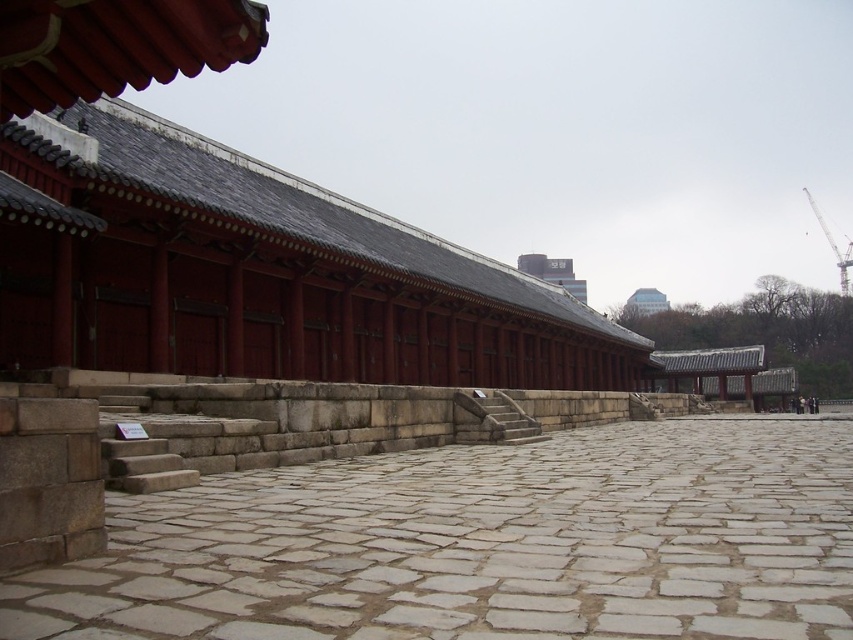
Question: Considering the real-world distances, which object is closest to the matte gray stone palace at upper center?

Choices:
 (A) gray stone courtyard at center
 (B) white glass building at upper center
 (C) matte red wood palace at center
 (D) stone textured stairs at center

Answer: (B)

Question: Is matte red wood palace at center to the right of stone textured stairs at center from the viewer's perspective?

Choices:
 (A) yes
 (B) no

Answer: (A)

Question: Is gray stone courtyard at center below white glass building at upper center?

Choices:
 (A) no
 (B) yes

Answer: (B)

Question: Estimate the real-world distances between objects in this image. Which object is farther from the gray stone courtyard at center?

Choices:
 (A) matte gray stone palace at upper center
 (B) white glass building at upper center
 (C) matte red wood palace at center
 (D) stone textured stairs at center

Answer: (A)

Question: Which point is farther to the camera?

Choices:
 (A) (525, 428)
 (B) (520, 266)

Answer: (B)

Question: From the image, what is the correct spatial relationship of stone textured stairs at center in relation to white glass building at upper center?

Choices:
 (A) right
 (B) left

Answer: (B)